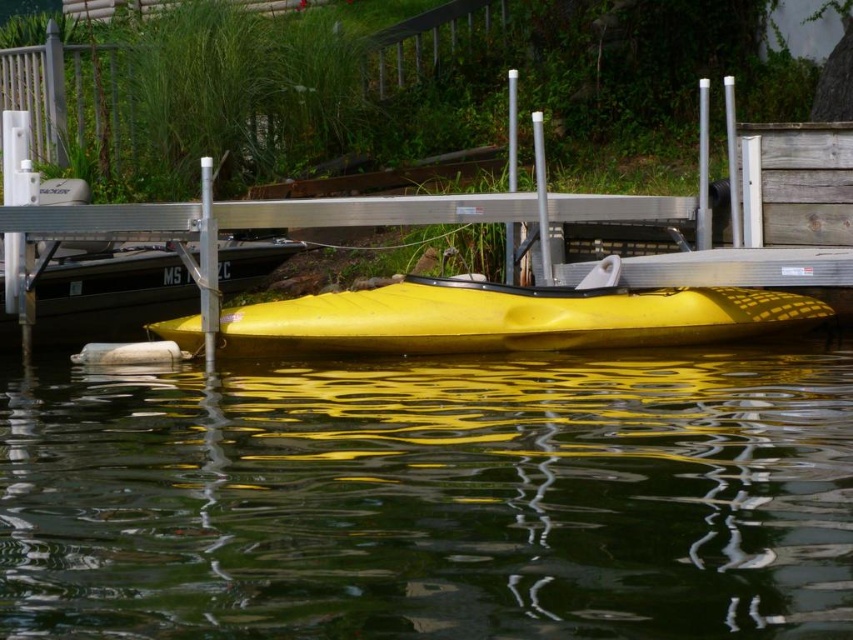
Consider the image. Between glossy yellow kayak at center and yellow matte kayak at center, which one is positioned lower?

Positioned lower is glossy yellow kayak at center.

Locate an element on the screen. This screenshot has width=853, height=640. glossy yellow kayak at center is located at coordinates (434, 499).

Who is more distant from viewer, (131,568) or (354,308)?

Point (354,308)

The width and height of the screenshot is (853, 640). I want to click on glossy yellow kayak at center, so click(434, 499).